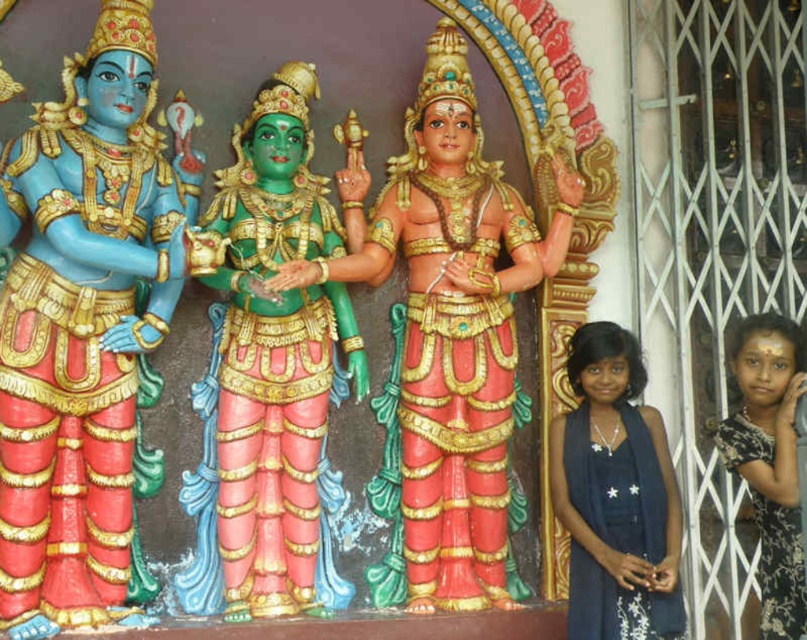
What do you see at coordinates (270, 378) in the screenshot? I see `green glossy statue at center` at bounding box center [270, 378].

Which is behind, point (279, 337) or point (592, 625)?

The point (592, 625) is more distant.

What are the coordinates of `green glossy statue at center` in the screenshot? It's located at (270, 378).

How much distance is there between polished gold statue at center and green glossy statue at center?

polished gold statue at center and green glossy statue at center are 4.04 meters apart.

Between point (513, 524) and point (295, 138), which one is positioned in front?

Positioned in front is point (295, 138).

What are the coordinates of `polished gold statue at center` in the screenshot? It's located at pyautogui.click(x=446, y=339).

Who is taller, matte blue deity at left or green glossy statue at center?

Standing taller between the two is matte blue deity at left.

Can you confirm if matte blue deity at left is positioned to the left of green glossy statue at center?

Correct, you'll find matte blue deity at left to the left of green glossy statue at center.

Does point (88, 518) come behind point (281, 474)?

No, (88, 518) is in front of (281, 474).

Identify the location of matte blue deity at left. (82, 330).